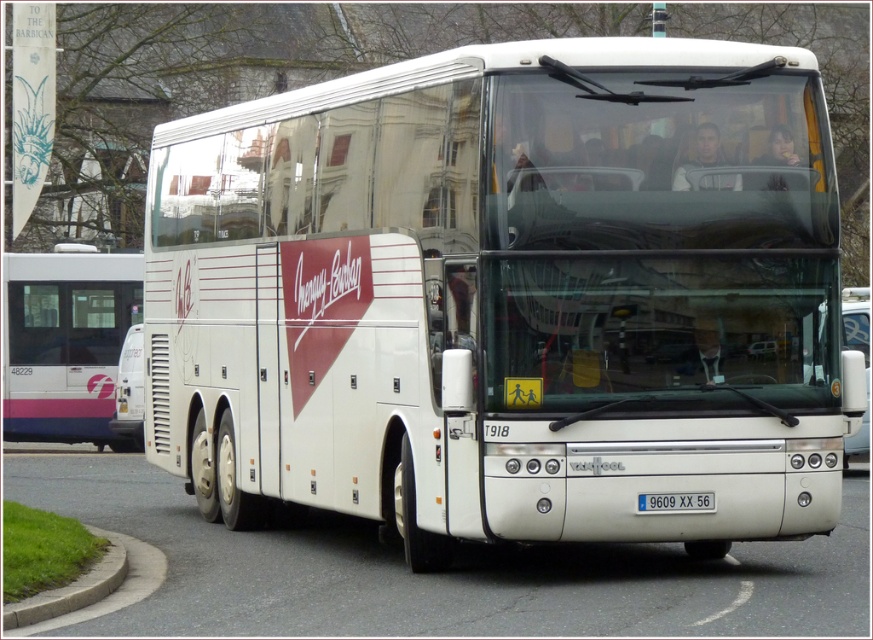
Question: Which object appears farthest from the camera in this image?

Choices:
 (A) white glossy bus at left
 (B) white glossy coach at center
 (C) white plastic license plate at center

Answer: (A)

Question: Can you confirm if white glossy coach at center is bigger than white plastic license plate at center?

Choices:
 (A) no
 (B) yes

Answer: (B)

Question: Does white glossy coach at center have a greater width compared to white glossy bus at left?

Choices:
 (A) yes
 (B) no

Answer: (B)

Question: Is white glossy bus at left further to the viewer compared to white plastic license plate at center?

Choices:
 (A) no
 (B) yes

Answer: (B)

Question: Which of the following is the closest to the observer?

Choices:
 (A) (25, 266)
 (B) (229, 420)

Answer: (B)

Question: Estimate the real-world distances between objects in this image. Which object is farther from the white glossy bus at left?

Choices:
 (A) white plastic license plate at center
 (B) white glossy coach at center

Answer: (B)